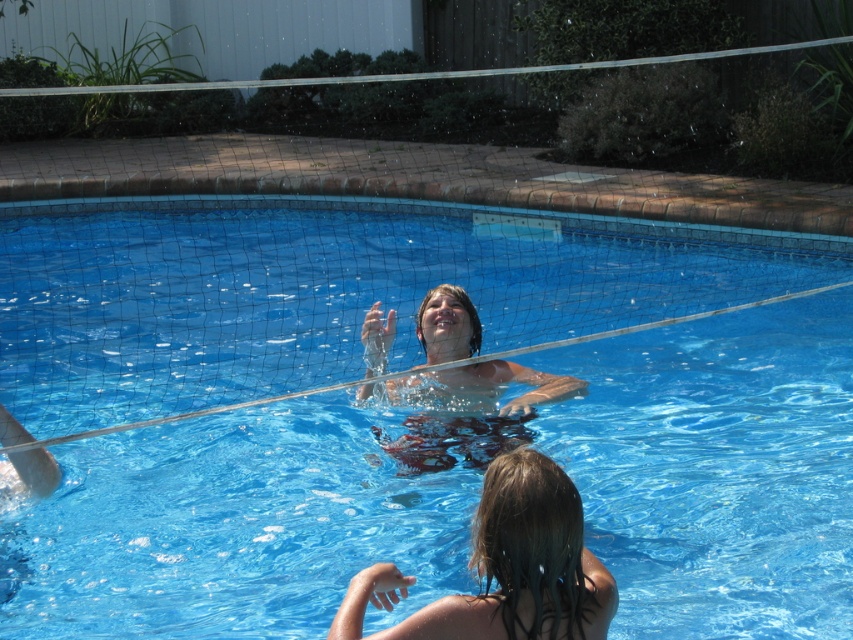
You are a swimmer trying to dive into the pool. Based on the scene, which object, the transparent blue water at center or the wet hair at lower center, would you need to be cautious of when entering the water?

The transparent blue water at center is much taller than the wet hair at lower center, so you should be cautious of the transparent blue water at center as it may be deeper and require careful entry to avoid injury.

You are standing at the edge of the pool and want to place a floating ring at the point marked as point (286, 388). Since the pool has a volleyball net dividing it into two sections, will the floating ring be placed on the water section with the net or the opposite side?

The point (286, 388) is on transparent blue water at center, so the floating ring will be placed on the water section with the net.

You are standing at the edge of the pool and want to touch both the transparent blue water at center and the wet hair at lower center. Which one should you reach for first to touch them without moving your hand from left to right?

You should reach for the transparent blue water at center first because it is located to the left of the wet hair at lower center, so you can touch it without moving your hand from left to right.